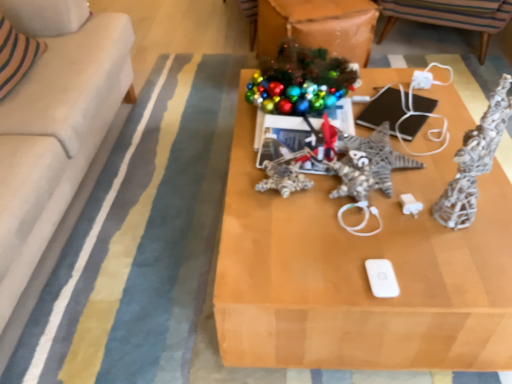
Identify the location of free location to the right of white matte ipod at center. (440, 269).